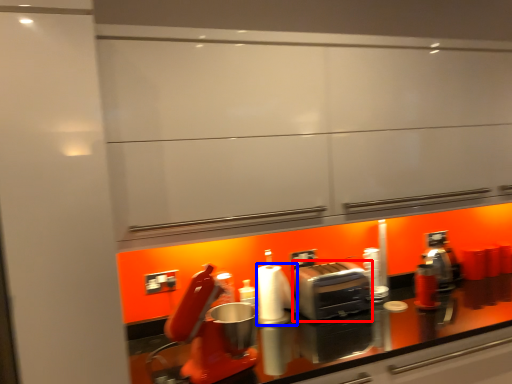
Question: Which of the following is the closest to the observer, toaster (highlighted by a red box) or paper towel (highlighted by a blue box)?

Choices:
 (A) toaster
 (B) paper towel

Answer: (B)